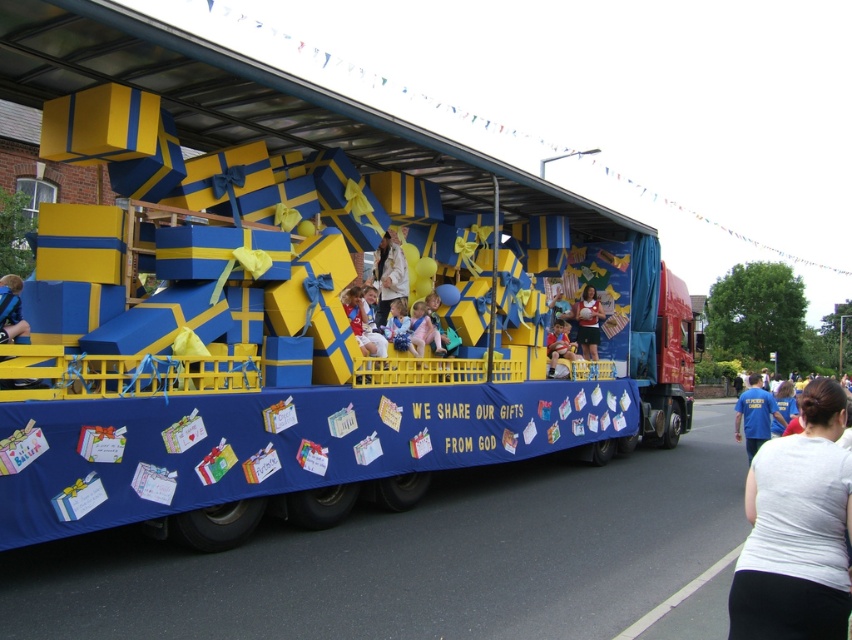
Between point (747, 420) and point (378, 336), which one is positioned behind?

The point (747, 420) is behind.

Does point (751, 417) come in front of point (354, 308)?

That is False.

The width and height of the screenshot is (852, 640). What are the coordinates of `blue t-shirt at right` in the screenshot? It's located at (755, 413).

Can you confirm if white cotton shirt at lower right is positioned above light blue fabric at center?

Incorrect, white cotton shirt at lower right is not positioned above light blue fabric at center.

Does point (812, 476) come closer to viewer compared to point (576, 355)?

Yes, it is in front of point (576, 355).

Where is `white cotton shirt at lower right`? white cotton shirt at lower right is located at coordinates (797, 531).

Is matte white dress at center further to the viewer compared to matte blue dress at center?

Yes, it is behind matte blue dress at center.

Which is below, matte white dress at center or matte blue dress at center?

matte white dress at center is lower down.

Who is more forward, (591, 289) or (381, 342)?

Point (381, 342) is more forward.

Identify the location of matte white dress at center. This screenshot has height=640, width=852. (586, 321).